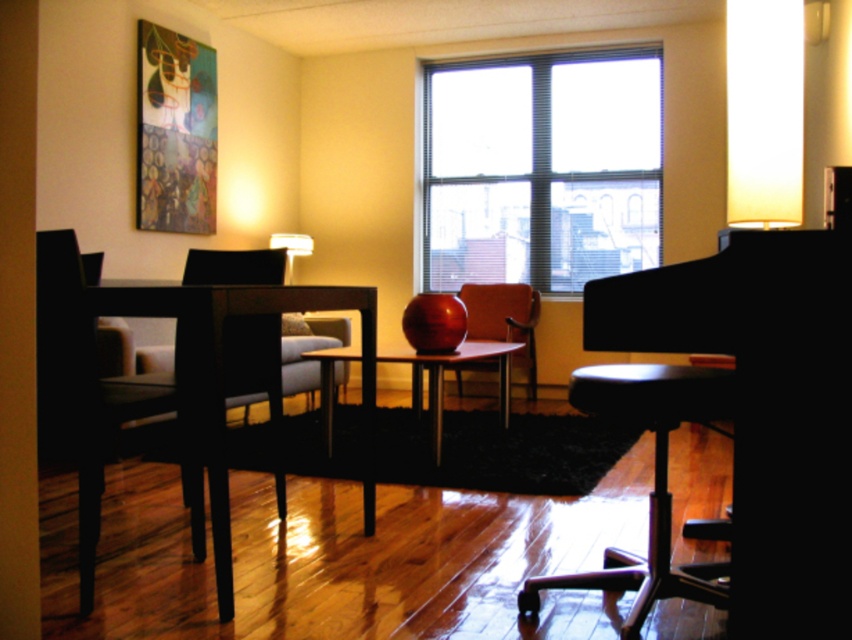
Question: Is transparent glass window at upper center thinner than matte orange chair at center?

Choices:
 (A) no
 (B) yes

Answer: (A)

Question: Among these points, which one is farthest from the camera?

Choices:
 (A) (537, 147)
 (B) (714, 260)
 (C) (482, 332)

Answer: (A)

Question: Among these objects, which one is nearest to the camera?

Choices:
 (A) matte orange chair at center
 (B) matte wood table at center
 (C) black plastic stool at lower right
 (D) transparent glass window at upper center

Answer: (C)

Question: Is black glossy piano at center closer to camera compared to matte wood table at center?

Choices:
 (A) yes
 (B) no

Answer: (A)

Question: Can you confirm if transparent glass window at upper center is positioned to the right of black plastic stool at lower right?

Choices:
 (A) no
 (B) yes

Answer: (B)

Question: Which is farther from the transparent glass window at upper center?

Choices:
 (A) matte orange chair at center
 (B) black glossy piano at center
 (C) matte wood table at center

Answer: (B)